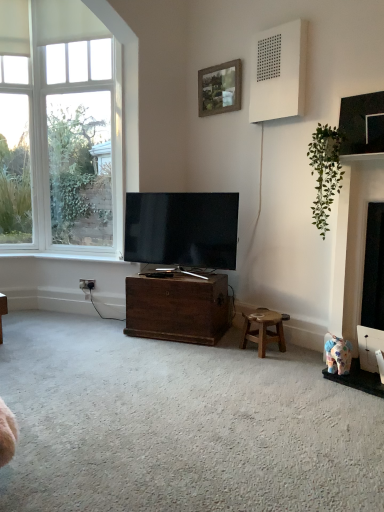
Find the location of `vacant area on top of white matte speaker at upper right (from a real-world perspective)`. vacant area on top of white matte speaker at upper right (from a real-world perspective) is located at coordinates (279, 23).